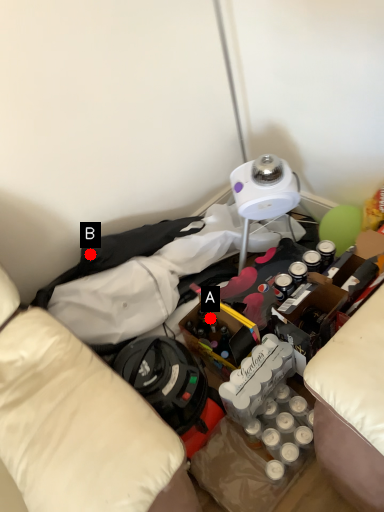
Question: Two points are circled on the image, labeled by A and B beside each circle. Which point is farther from the camera taking this photo?

Choices:
 (A) A is further
 (B) B is further

Answer: (A)